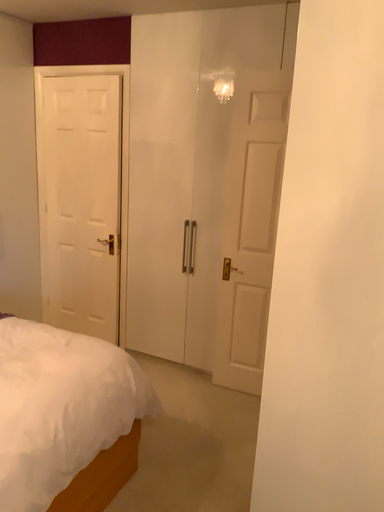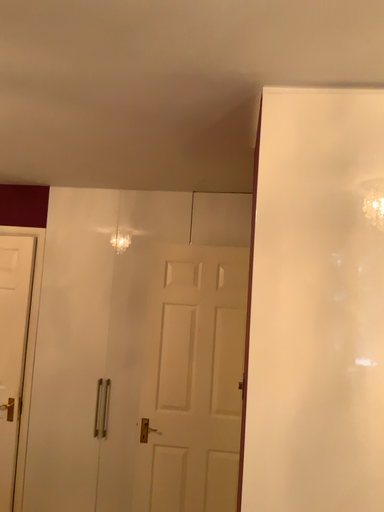
Question: Which way did the camera rotate in the video?

Choices:
 (A) rotated left
 (B) rotated right

Answer: (B)